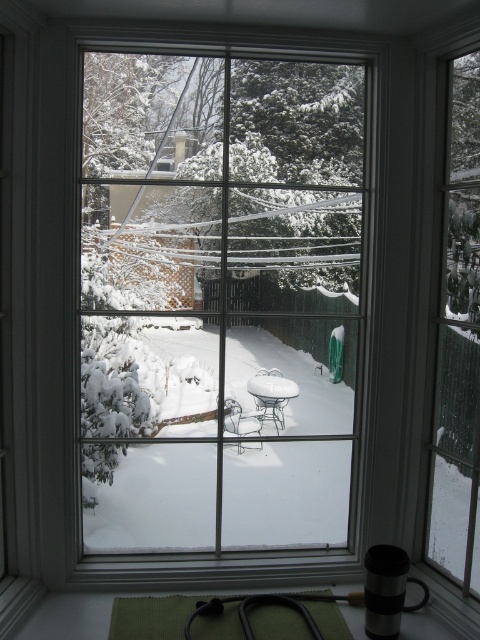
Can you confirm if clear glass window at center is wider than clear glass window at right?

Indeed, clear glass window at center has a greater width compared to clear glass window at right.

The height and width of the screenshot is (640, 480). Identify the location of clear glass window at center. (219, 301).

Is point (103, 392) closer to viewer compared to point (464, 250)?

No, (103, 392) is further to viewer.

The height and width of the screenshot is (640, 480). What are the coordinates of `clear glass window at center` in the screenshot? It's located at (219, 301).